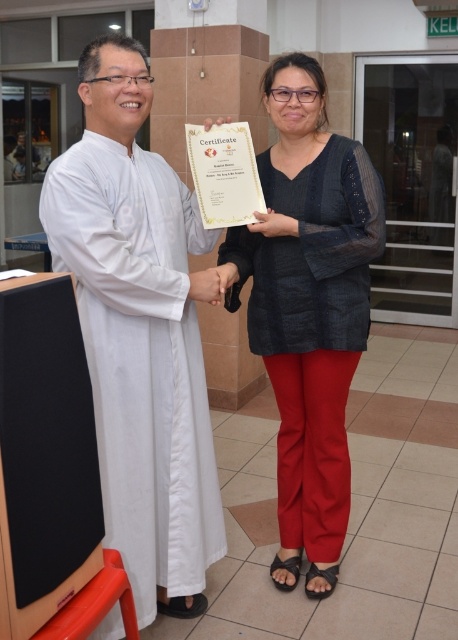
Is white clothed man at left to the left of matte black blouse at center from the viewer's perspective?

Yes, white clothed man at left is to the left of matte black blouse at center.

Is white clothed man at left closer to camera compared to matte black blouse at center?

Yes, it is in front of matte black blouse at center.

Locate an element on the screen. white clothed man at left is located at coordinates (140, 332).